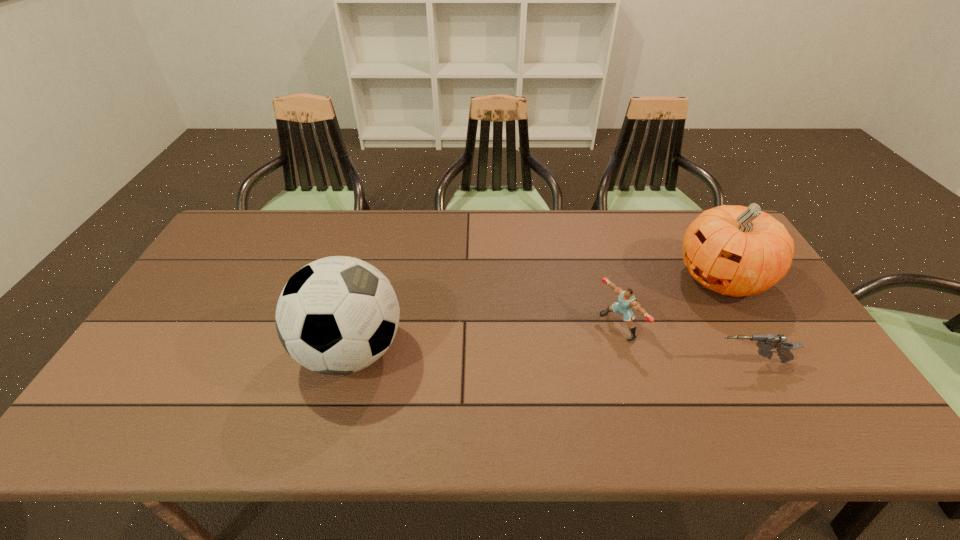
Where is `vacant space situated on the front-facing side of the pumpkin`? The height and width of the screenshot is (540, 960). vacant space situated on the front-facing side of the pumpkin is located at coordinates (606, 337).

Identify the location of vacant space situated 0.390m on the front-facing side of the pumpkin. The image size is (960, 540). (586, 347).

Find the location of `free space located on the front-facing side of the third object from right to left`. free space located on the front-facing side of the third object from right to left is located at coordinates (532, 376).

Where is `vacant region located 0.310m on the front-facing side of the third object from right to left`? The height and width of the screenshot is (540, 960). vacant region located 0.310m on the front-facing side of the third object from right to left is located at coordinates (508, 388).

Identify the location of blank area located on the front-facing side of the third object from right to left. The width and height of the screenshot is (960, 540). (555, 364).

This screenshot has height=540, width=960. What are the coordinates of `object at the far edge` in the screenshot? It's located at (734, 250).

Identify the location of object situated at the near edge. This screenshot has height=540, width=960. (337, 315).

Identify the location of gun that is at the right edge. This screenshot has width=960, height=540. (767, 342).

Where is `pumpkin at the right edge`? pumpkin at the right edge is located at coordinates (734, 250).

I want to click on object present at the far right corner, so click(x=734, y=250).